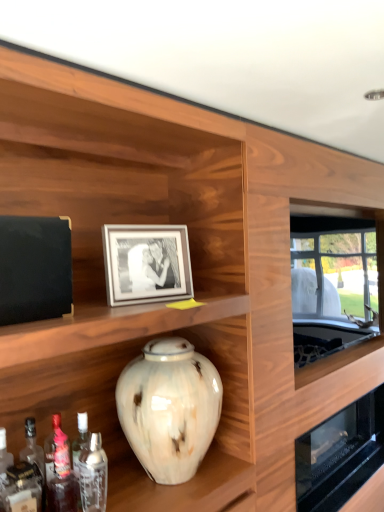
Question: Is clear glass bottle at lower left, the second bottle positioned from the left, taller or shorter than marbled ceramic vase at center?

Choices:
 (A) tall
 (B) short

Answer: (B)

Question: Visually, is clear glass bottle at lower left, acting as the 1th bottle starting from the right, positioned to the left or to the right of marbled ceramic vase at center?

Choices:
 (A) right
 (B) left

Answer: (B)

Question: Which object is the closest to the clear glass bottle at lower left, the second bottle positioned from the left?

Choices:
 (A) marbled ceramic vase at center
 (B) matte silver picture frame at center
 (C) translucent glass bottle at lower left, which appears as the first bottle when viewed from the left
 (D) transparent glass window at right

Answer: (C)

Question: Estimate the real-world distances between objects in this image. Which object is closer to the clear glass bottle at lower left, acting as the 1th bottle starting from the right?

Choices:
 (A) marbled ceramic vase at center
 (B) translucent glass bottle at lower left, marked as the second bottle in a right-to-left arrangement
 (C) matte silver picture frame at center
 (D) transparent glass window at right

Answer: (B)